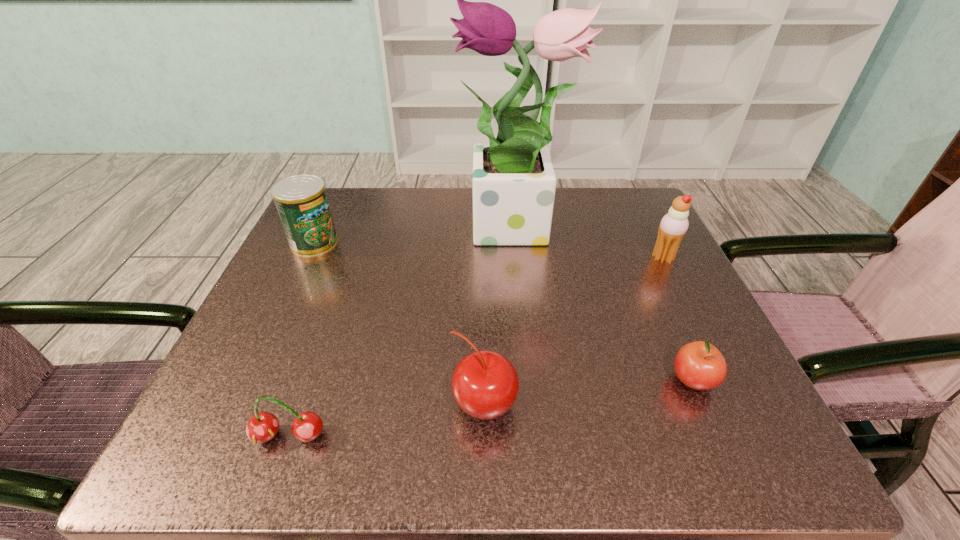
Identify the location of empty space that is in between the can and the apple. point(504,312).

At what (x,y) coordinates should I click in order to perform the action: click on vacant region between the apple and the can. Please return your answer as a coordinate pair (x, y). Looking at the image, I should click on (504, 312).

Where is `vacant region between the flower arrangement and the can`? vacant region between the flower arrangement and the can is located at coordinates (414, 237).

Find the location of a particular element. Image resolution: width=960 pixels, height=540 pixels. free space between the left cherry and the right cherry is located at coordinates (387, 421).

This screenshot has height=540, width=960. Find the location of `vacant space that's between the flower arrangement and the taller cherry`. vacant space that's between the flower arrangement and the taller cherry is located at coordinates tap(499, 318).

The width and height of the screenshot is (960, 540). What are the coordinates of `empty location between the flower arrangement and the can` in the screenshot? It's located at [414, 237].

Where is `empty location between the apple and the fourth tallest object`? The height and width of the screenshot is (540, 960). empty location between the apple and the fourth tallest object is located at coordinates (588, 393).

Locate an element on the screen. The image size is (960, 540). free space between the icecream and the tallest object is located at coordinates (588, 244).

You are a GUI agent. You are given a task and a screenshot of the screen. Output one action in this format:
    pyautogui.click(x=<x>, y=<y>)
    Task: Click on the object identified as the second closest to the can
    
    Given the screenshot: What is the action you would take?
    pyautogui.click(x=262, y=427)

Identify the location of object that can be found as the second closest to the fourth tallest object. The height and width of the screenshot is (540, 960). (699, 365).